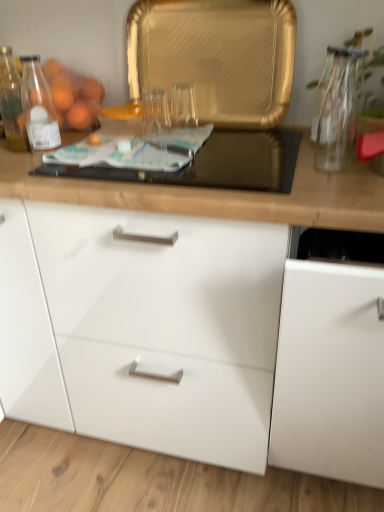
Question: Considering the positions of point coord(44,118) and point coord(369,391), is point coord(44,118) closer or farther from the camera than point coord(369,391)?

Choices:
 (A) closer
 (B) farther

Answer: (B)

Question: Considering the positions of translucent glass bottle at left and white glossy cabinet at right, which is the 2th cabinetry in left-to-right order, in the image, is translucent glass bottle at left wider or thinner than white glossy cabinet at right, which is the 2th cabinetry in left-to-right order,?

Choices:
 (A) thin
 (B) wide

Answer: (A)

Question: Which object is the farthest from the white glossy cabinet at center, positioned as the 2th cabinetry in right-to-left order?

Choices:
 (A) transparent glass vase at upper right
 (B) white glossy cabinet at right, the 1th cabinetry viewed from the right
 (C) black glass gas stove at center
 (D) translucent glass bottle at left
 (E) orange matte plastic bag at upper left

Answer: (E)

Question: Considering the real-world distances, which object is farthest from the transparent glass vase at right?

Choices:
 (A) white glossy cabinet at right, the 1th cabinetry viewed from the right
 (B) white glossy cabinet at center, which is the 1th cabinetry from left to right
 (C) translucent glass bottle at left
 (D) orange matte plastic bag at upper left
 (E) transparent glass vase at upper right

Answer: (B)